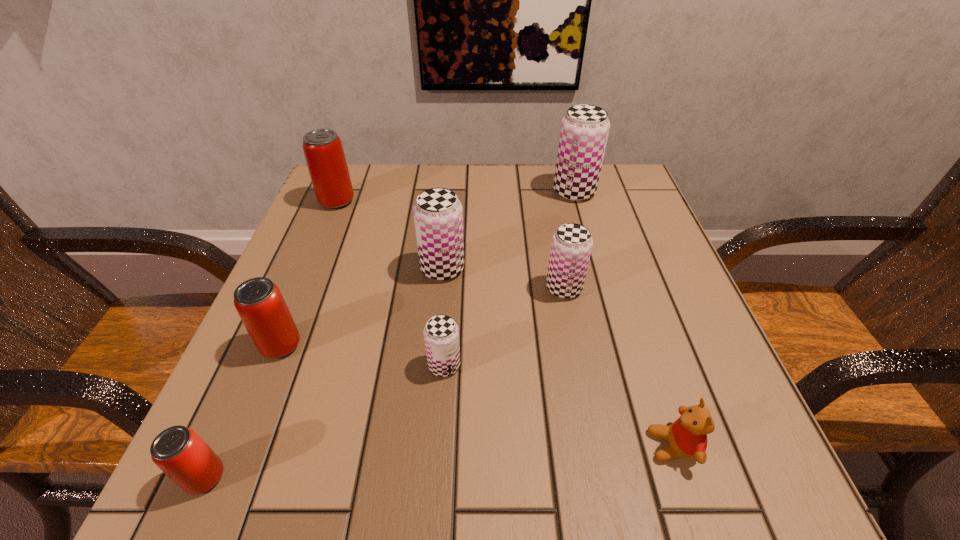
This screenshot has width=960, height=540. Find the location of `vacant point located between the second nearest pink beer can and the second smallest purple beer can`. vacant point located between the second nearest pink beer can and the second smallest purple beer can is located at coordinates (422, 316).

The image size is (960, 540). What are the coordinates of `vacant space that's between the red teddy bear and the tallest object` in the screenshot? It's located at (624, 319).

The width and height of the screenshot is (960, 540). What are the coordinates of `object that is the fifth nearest to the biggest pink beer can` in the screenshot? It's located at (584, 131).

Find the location of a particular element. This screenshot has width=960, height=540. object that is the fifth closest to the nearest purple beer can is located at coordinates (178, 451).

I want to click on beer can that stands as the fourth closest to the second biggest pink beer can, so click(x=323, y=150).

The width and height of the screenshot is (960, 540). What are the coordinates of `the fourth closest beer can relative to the farthest pink beer can` in the screenshot? It's located at (571, 247).

Identify the location of purple beer can object that ranks as the closest to the second smallest purple beer can. Image resolution: width=960 pixels, height=540 pixels. (438, 216).

You are a GUI agent. You are given a task and a screenshot of the screen. Output one action in this format:
    pyautogui.click(x=<x>, y=<y>)
    Task: Click on the purple beer can that is the third closest to the biggest pink beer can
    
    Given the screenshot: What is the action you would take?
    pyautogui.click(x=571, y=247)

Where is `pink beer can that is the closest to the farthest pink beer can`? pink beer can that is the closest to the farthest pink beer can is located at coordinates (258, 301).

Locate an element on the screen. The image size is (960, 540). the second closest pink beer can relative to the third biggest purple beer can is located at coordinates (323, 150).